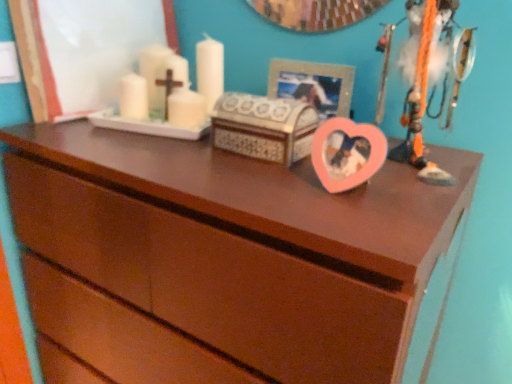
This screenshot has height=384, width=512. In order to click on empty space that is ontop of brown wood chest of drawers at center in this screenshot , I will do `click(228, 158)`.